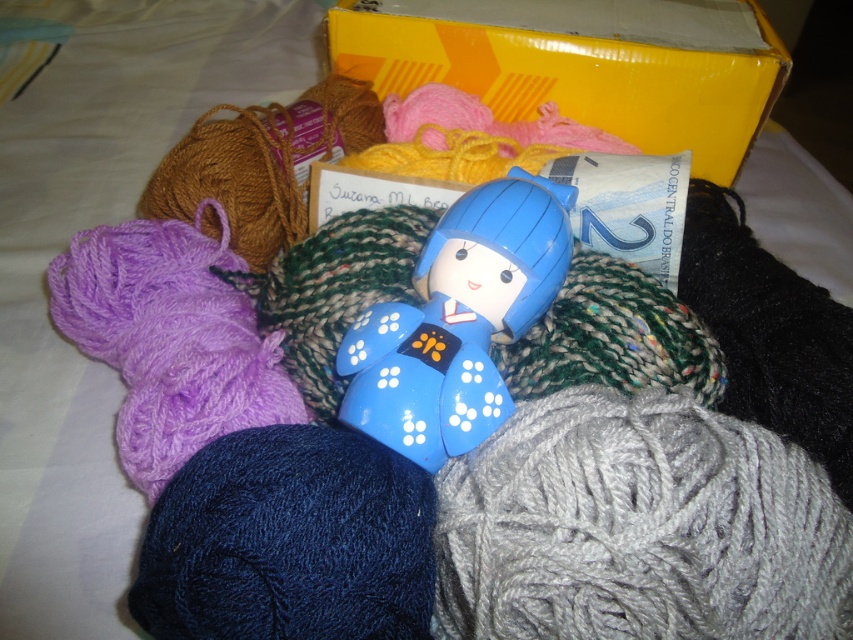
Question: Which point is farther from the camera taking this photo?

Choices:
 (A) click(750, 141)
 (B) click(438, 451)

Answer: (A)

Question: Can you confirm if yellow cardboard box at upper center is wider than blue glossy doll at center?

Choices:
 (A) yes
 (B) no

Answer: (A)

Question: Can you confirm if yellow cardboard box at upper center is positioned above blue glossy doll at center?

Choices:
 (A) no
 (B) yes

Answer: (B)

Question: Can you confirm if yellow cardboard box at upper center is wider than blue glossy doll at center?

Choices:
 (A) no
 (B) yes

Answer: (B)

Question: Which point appears farthest from the camera in this image?

Choices:
 (A) (339, 45)
 (B) (416, 326)

Answer: (A)